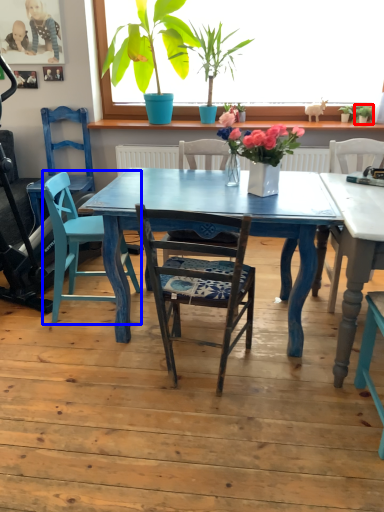
Question: Which point is closer to the camera, houseplant (highlighted by a red box) or swivel chair (highlighted by a blue box)?

Choices:
 (A) houseplant
 (B) swivel chair

Answer: (B)